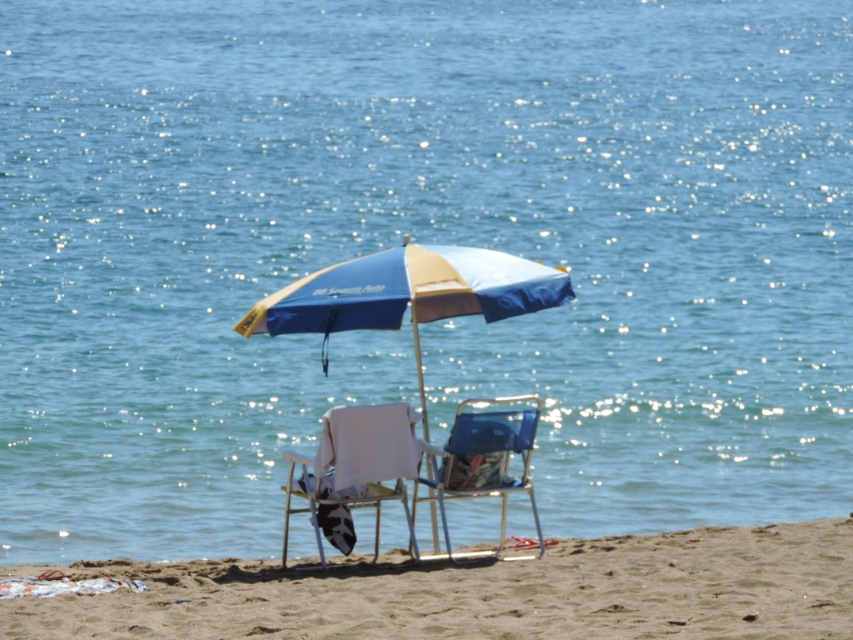
Question: Which point is closer to the camera taking this photo?

Choices:
 (A) pyautogui.click(x=418, y=454)
 (B) pyautogui.click(x=410, y=262)

Answer: (A)

Question: Is sandy brown at lower center closer to camera compared to white fabric chair at center?

Choices:
 (A) no
 (B) yes

Answer: (B)

Question: Is blue fabric umbrella at center to the right of white fabric chair at center from the viewer's perspective?

Choices:
 (A) yes
 (B) no

Answer: (A)

Question: Which point is closer to the camera taking this photo?

Choices:
 (A) (505, 484)
 (B) (67, 605)
 (C) (422, 312)

Answer: (B)

Question: Estimate the real-world distances between objects in this image. Which object is closer to the blue fabric umbrella at center?

Choices:
 (A) white fabric chair at center
 (B) blue fabric chair at center

Answer: (A)

Question: Does sandy brown at lower center appear under blue fabric umbrella at center?

Choices:
 (A) no
 (B) yes

Answer: (B)